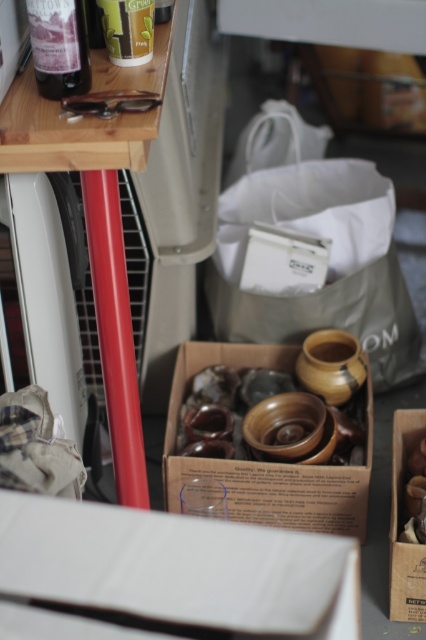
You are organizing a kitchen and need to place a wooden spoon in a drawer. The drawer is 30 centimeters wide. Can the wooden spoon at center fit into the drawer if there are wooden bowls at center already occupying space?

The wooden bowls at center and wooden spoon at center are 31.23 centimeters apart. Since the drawer is only 30 centimeters wide, the wooden spoon at center may not fit alongside the wooden bowls at center due to the limited space.

You are organizing items in the storage area and need to place a new item exactly where the wooden bowls at center were. According to the image, what are the coordinates of the location where you should place the new item?

The wooden bowls at center are located at coordinates point (267, 461), so you should place the new item there.